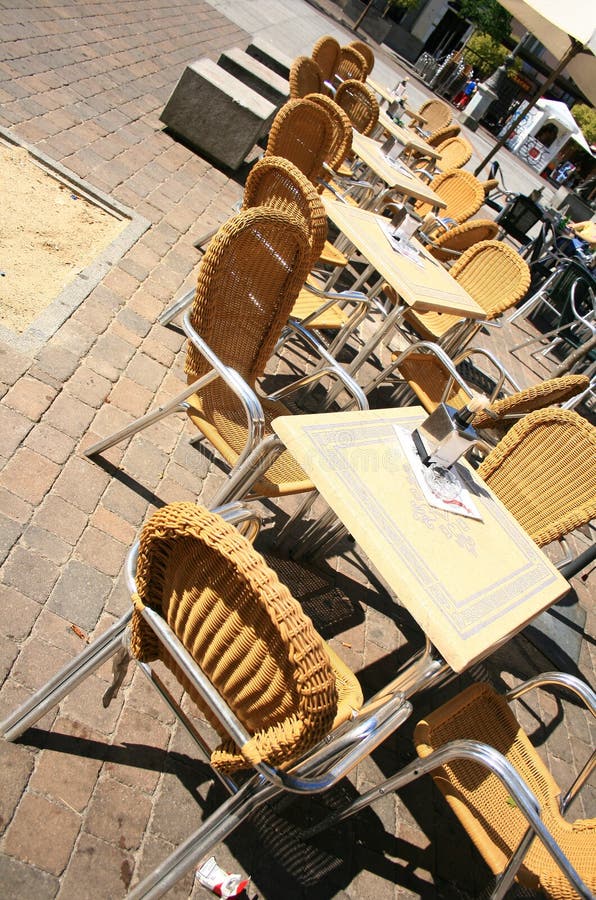
Image resolution: width=596 pixels, height=900 pixels. I want to click on tables, so pyautogui.click(x=414, y=544), pyautogui.click(x=415, y=274), pyautogui.click(x=381, y=162), pyautogui.click(x=390, y=127), pyautogui.click(x=387, y=90).